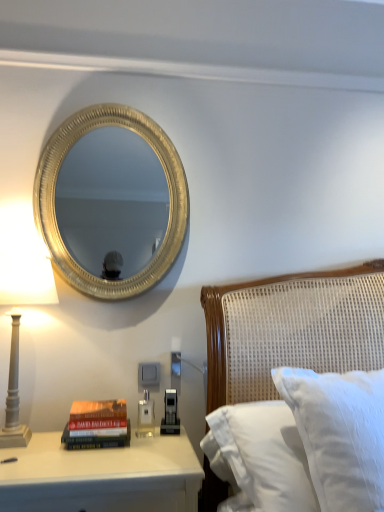
The height and width of the screenshot is (512, 384). In order to click on hardcover book at lower left in this screenshot , I will do `click(97, 425)`.

At what (x,y) coordinates should I click in order to perform the action: click on white textured pillow at right. Please return your answer as a coordinate pair (x, y). Looking at the image, I should click on (291, 329).

What do you see at coordinates (101, 476) in the screenshot?
I see `white glossy nightstand at lower left` at bounding box center [101, 476].

Measure the distance between point (125, 277) and camera.

The depth of point (125, 277) is 6.03 feet.

This screenshot has width=384, height=512. Find the location of `hardcover book at lower left`. hardcover book at lower left is located at coordinates (97, 425).

Can hardcover book at lower left be found inside gray columnar lamp at left?

Definitely not — hardcover book at lower left is not inside gray columnar lamp at left.

You are a GUI agent. You are given a task and a screenshot of the screen. Output one action in this format:
    pyautogui.click(x=<x>, y=<y>)
    Task: Click on the paperback book lying below the gray columnar lamp at left (from the image's perspective)
    
    Given the screenshot: What is the action you would take?
    pyautogui.click(x=97, y=425)

From a real-world perspective, which object rests below the other?

hardcover book at lower left.

Does gray columnar lamp at left have a greater width compared to hardcover book at lower left?

Yes.

Is white glossy nightstand at lower left positioned with its back to gray columnar lamp at left?

No, white glossy nightstand at lower left's orientation is not away from gray columnar lamp at left.

Which object is thinner, white glossy nightstand at lower left or gray columnar lamp at left?

Thinner between the two is gray columnar lamp at left.

Relative to gray columnar lamp at left, is white glossy nightstand at lower left in front or behind?

white glossy nightstand at lower left is positioned closer to the viewer than gray columnar lamp at left.

From a real-world perspective, is white glossy nightstand at lower left over gray columnar lamp at left?

No, from a real-world perspective, white glossy nightstand at lower left is not on top of gray columnar lamp at left.

Is white glossy nightstand at lower left completely or partially inside gray columnar lamp at left?

Actually, white glossy nightstand at lower left is outside gray columnar lamp at left.

Is the position of gray columnar lamp at left less distant than that of white glossy nightstand at lower left?

No, the depth of gray columnar lamp at left is greater than that of white glossy nightstand at lower left.

Identify the location of bedside lamp to the left of white glossy nightstand at lower left. (26, 279).

From the picture: Is gray columnar lamp at left oriented towards white glossy nightstand at lower left?

No, gray columnar lamp at left does not turn towards white glossy nightstand at lower left.

From a real-world perspective, is hardcover book at lower left physically located above or below gold textured mirror at upper left?

hardcover book at lower left is situated lower than gold textured mirror at upper left in the real world.

How much distance is there between hardcover book at lower left and gold textured mirror at upper left?

They are 8.69 feet apart.

Does hardcover book at lower left appear on the left side of gold textured mirror at upper left?

Yes, hardcover book at lower left is to the left of gold textured mirror at upper left.

Is hardcover book at lower left touching gold textured mirror at upper left?

No, hardcover book at lower left is not next to gold textured mirror at upper left.

From the image's perspective, does gray columnar lamp at left appear higher than white textured pillow at right?

Yes.

Would you say gray columnar lamp at left contains white textured pillow at right?

That's incorrect, white textured pillow at right is not inside gray columnar lamp at left.

Measure the distance from gray columnar lamp at left to white textured pillow at right.

The distance of gray columnar lamp at left from white textured pillow at right is 38.28 inches.

What's the angular difference between gray columnar lamp at left and white textured pillow at right's facing directions?

The angular difference between gray columnar lamp at left and white textured pillow at right is 1.16 degrees.

Is white glossy nightstand at lower left wider or thinner than hardcover book at lower left?

Clearly, white glossy nightstand at lower left has more width compared to hardcover book at lower left.

Is white glossy nightstand at lower left taller or shorter than hardcover book at lower left?

Considering their sizes, white glossy nightstand at lower left has more height than hardcover book at lower left.

Is point (45, 476) closer or farther from the camera than point (104, 443)?

Point (45, 476).

Locate an element on the screen. This screenshot has width=384, height=512. nightstand below the gold textured mirror at upper left (from a real-world perspective) is located at coordinates (101, 476).

Is white glossy nightstand at lower left aimed at gold textured mirror at upper left?

No, white glossy nightstand at lower left does not turn towards gold textured mirror at upper left.

From a real-world perspective, is white glossy nightstand at lower left above or below gold textured mirror at upper left?

From a real-world perspective, white glossy nightstand at lower left is physically below gold textured mirror at upper left.

In the scene shown: From the image's perspective, which one is positioned higher, white glossy nightstand at lower left or gold textured mirror at upper left?

From the image's view, gold textured mirror at upper left is above.

At what (x,y) coordinates should I click in order to perform the action: click on paperback book below the gray columnar lamp at left (from a real-world perspective). Please return your answer as a coordinate pair (x, y). Looking at the image, I should click on (97, 425).

Where is `bedside lamp behind the white glossy nightstand at lower left`? The height and width of the screenshot is (512, 384). bedside lamp behind the white glossy nightstand at lower left is located at coordinates (26, 279).

Based on their spatial positions, is gray columnar lamp at left or hardcover book at lower left closer to white textured pillow at right?

hardcover book at lower left lies closer to white textured pillow at right than the other object.

Looking at the image, which one is located closer to white textured pillow at right, hardcover book at lower left or gray columnar lamp at left?

hardcover book at lower left lies closer to white textured pillow at right than the other object.

From the image, which object appears to be farther from gold textured mirror at upper left, white textured pillow at right or white glossy nightstand at lower left?

white textured pillow at right.

Which object lies nearer to the anchor point hardcover book at lower left, white glossy nightstand at lower left or gold textured mirror at upper left?

white glossy nightstand at lower left.

When comparing their distances from white textured pillow at right, does gold textured mirror at upper left or white glossy nightstand at lower left seem closer?

Based on the image, white glossy nightstand at lower left appears to be nearer to white textured pillow at right.

Which object lies further to the anchor point gold textured mirror at upper left, white textured pillow at right or gray columnar lamp at left?

gray columnar lamp at left is further to gold textured mirror at upper left.

From the image, which object appears to be farther from white textured pillow at right, hardcover book at lower left or gold textured mirror at upper left?

gold textured mirror at upper left.

When comparing their distances from white textured pillow at right, does white glossy nightstand at lower left or gold textured mirror at upper left seem closer?

Based on the image, white glossy nightstand at lower left appears to be nearer to white textured pillow at right.

Find the location of a particular element. The width and height of the screenshot is (384, 512). bedside lamp between gold textured mirror at upper left and white glossy nightstand at lower left in the up-down direction is located at coordinates (26, 279).

Where is `paperback book between gold textured mirror at upper left and white glossy nightstand at lower left from top to bottom`? paperback book between gold textured mirror at upper left and white glossy nightstand at lower left from top to bottom is located at coordinates (97, 425).

The height and width of the screenshot is (512, 384). Identify the location of paperback book located between white glossy nightstand at lower left and white textured pillow at right in the left-right direction. (97, 425).

Locate an element on the screen. The width and height of the screenshot is (384, 512). bedside lamp between gold textured mirror at upper left and hardcover book at lower left vertically is located at coordinates (26, 279).